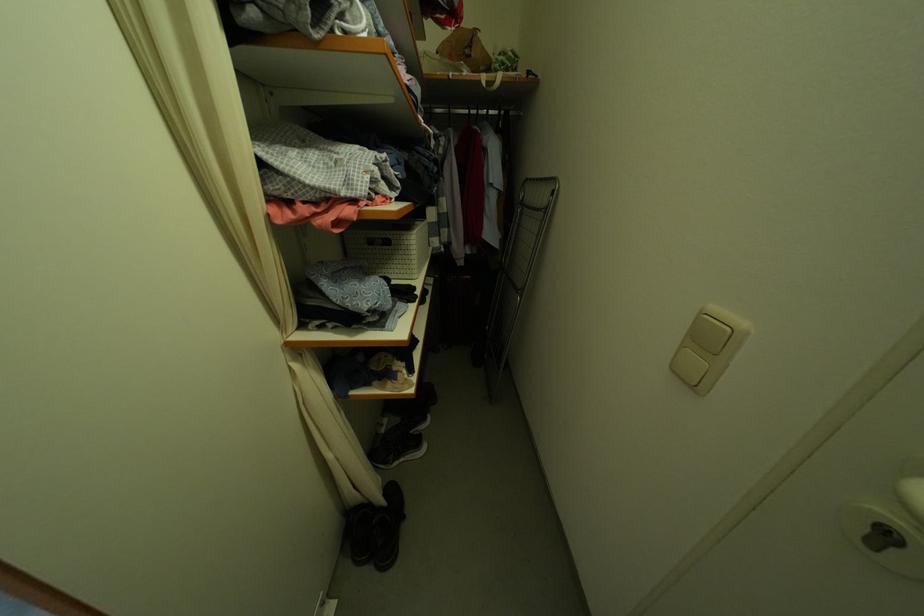
You are a GUI agent. You are given a task and a screenshot of the screen. Output one action in this format:
    pyautogui.click(x=<x>, y=<y>)
    Task: Click on the door keyhole
    
    Given the screenshot: What is the action you would take?
    pyautogui.click(x=881, y=538)